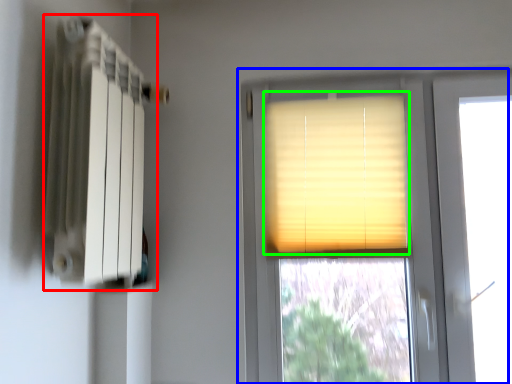
Question: Based on their relative distances, which object is nearer to radiator (highlighted by a red box)? Choose from window (highlighted by a blue box) and window blind (highlighted by a green box).

Choices:
 (A) window
 (B) window blind

Answer: (B)